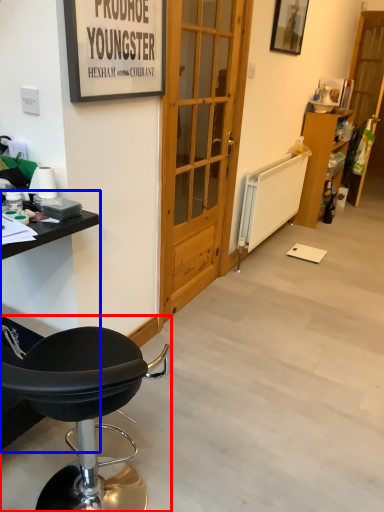
Question: Which of the following is the closest to the observer, chair (highlighted by a red box) or table (highlighted by a blue box)?

Choices:
 (A) chair
 (B) table

Answer: (A)